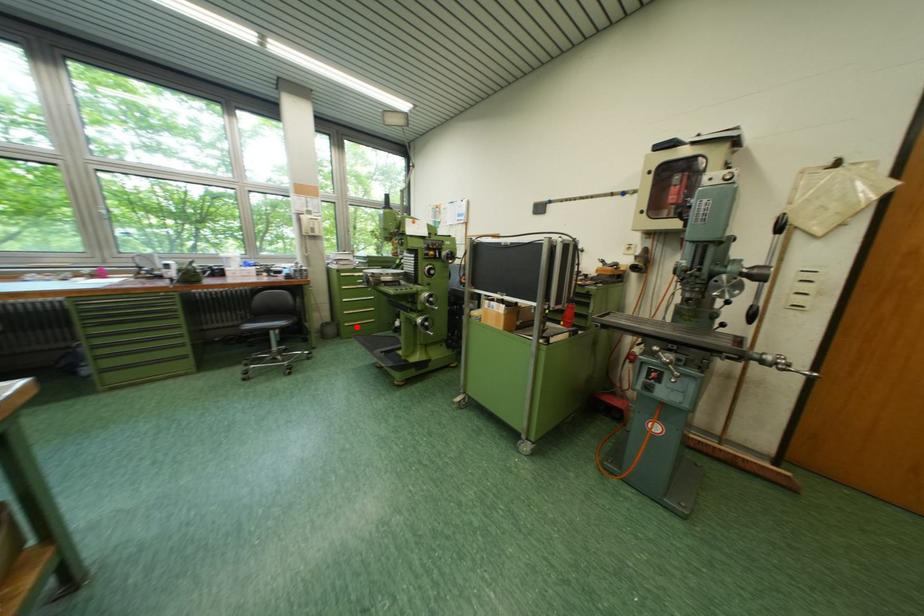
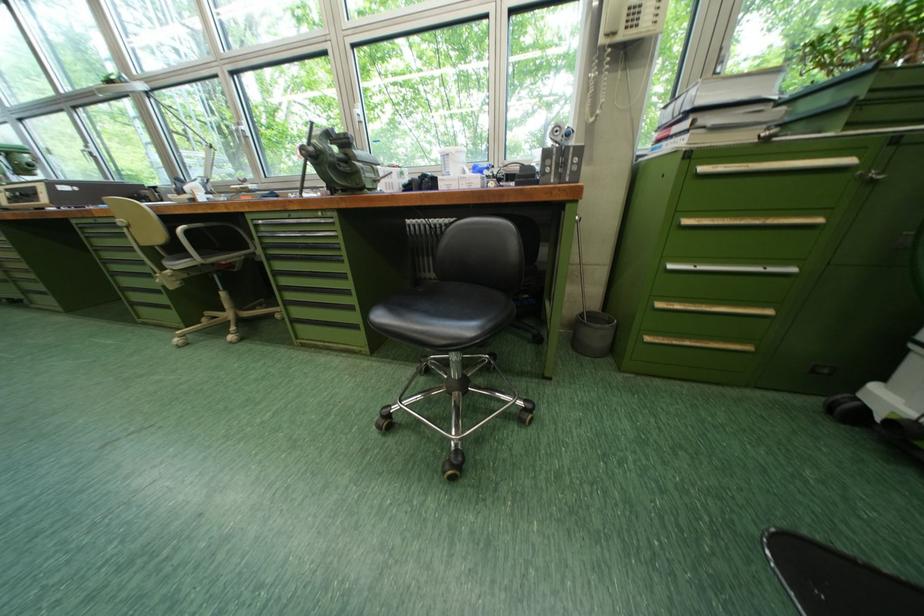
Question: I am providing you with two images of the same scene from different viewpoints. Image1 has a red point marked. In image2, the corresponding 3D location appears at what relative position? Reply with the corresponding letter.

Choices:
 (A) Closer
 (B) Farther

Answer: (A)